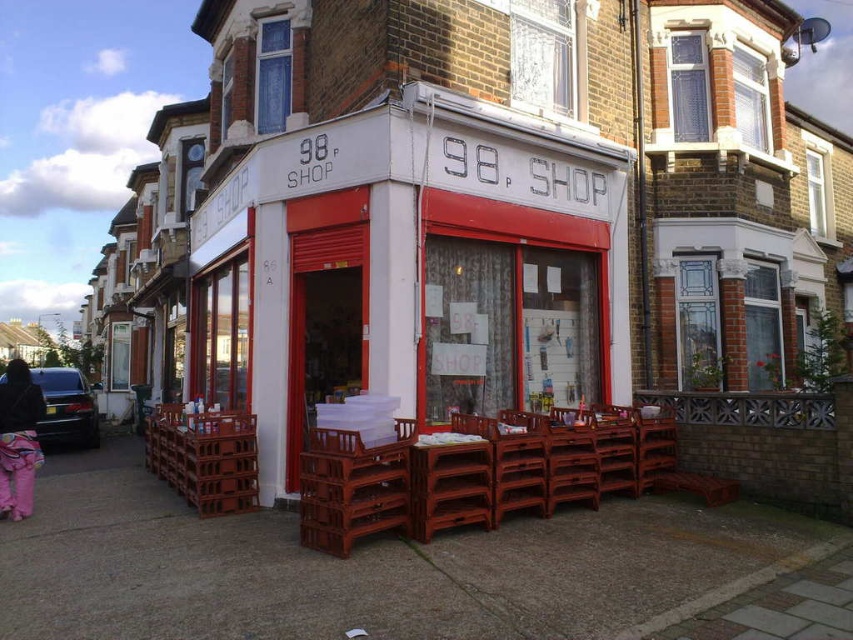
The height and width of the screenshot is (640, 853). Describe the element at coordinates (412, 269) in the screenshot. I see `matte white sign at center` at that location.

Between point (451, 278) and point (540, 461), which one is positioned in front?

Positioned in front is point (540, 461).

Which is in front, point (245, 244) or point (538, 445)?

Point (538, 445) is in front.

Locate an element on the screen. matte white sign at center is located at coordinates (412, 269).

Who is higher up, brown wooden crate at center or brown wooden crate at lower left?

Positioned higher is brown wooden crate at center.

Does brown wooden crate at center have a smaller size compared to brown wooden crate at lower left?

Yes, brown wooden crate at center is smaller than brown wooden crate at lower left.

What do you see at coordinates (351, 496) in the screenshot? The image size is (853, 640). I see `brown wooden crate at center` at bounding box center [351, 496].

Identify the location of brown wooden crate at center. (351, 496).

Who is taller, mahogany wood table at center or brown wooden chair at center?

Standing taller between the two is brown wooden chair at center.

Between point (469, 492) and point (535, 499), which one is positioned behind?

Point (535, 499)

Is point (471, 449) farther from viewer compared to point (532, 461)?

No, (471, 449) is closer to viewer.

In order to click on mahogany wood table at center in this screenshot , I will do `click(450, 483)`.